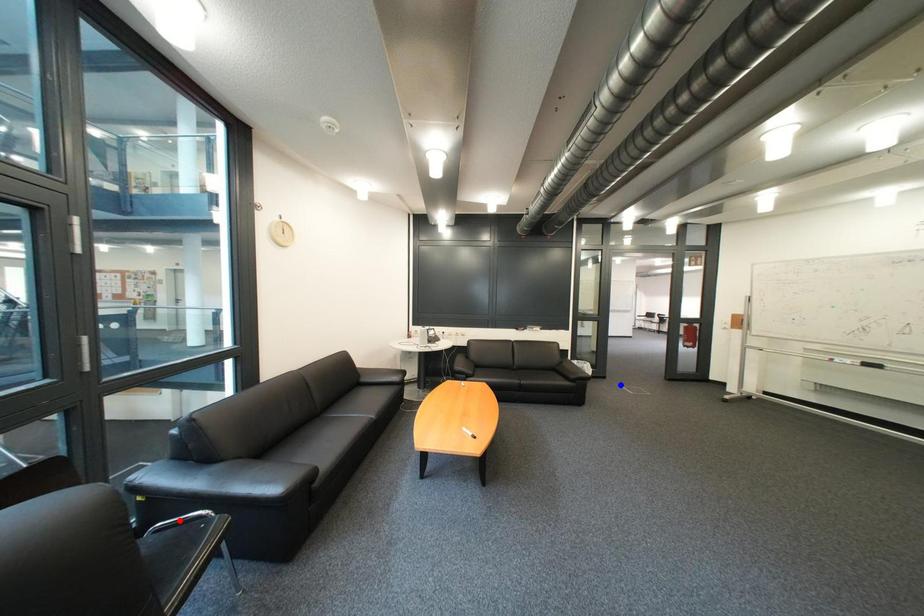
Question: Two points are marked on the image. Which point is closer to the camera?

Choices:
 (A) Blue point is closer.
 (B) Red point is closer.

Answer: (B)